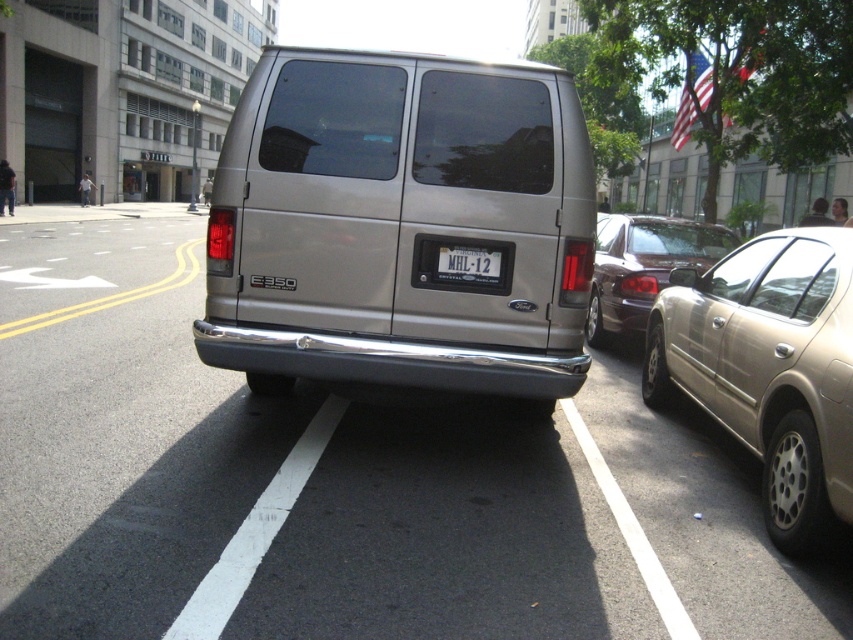
Question: Can you confirm if gold metallic sedan at right is wider than white plastic license plate at center?

Choices:
 (A) no
 (B) yes

Answer: (B)

Question: Is the position of satin silver van at center less distant than that of white plastic license plate at center?

Choices:
 (A) yes
 (B) no

Answer: (A)

Question: Which object appears closest to the camera in this image?

Choices:
 (A) shiny dark brown sedan at center-right
 (B) gold metallic sedan at right

Answer: (B)

Question: Does satin silver van at center have a greater width compared to white plastic license plate at center?

Choices:
 (A) no
 (B) yes

Answer: (B)

Question: Among these objects, which one is farthest from the camera?

Choices:
 (A) shiny dark brown sedan at center-right
 (B) white plastic license plate at center
 (C) gold metallic sedan at right
 (D) satin silver van at center

Answer: (B)

Question: Which object appears closest to the camera in this image?

Choices:
 (A) gold metallic sedan at right
 (B) shiny dark brown sedan at center-right
 (C) white plastic license plate at center
 (D) satin silver van at center

Answer: (A)